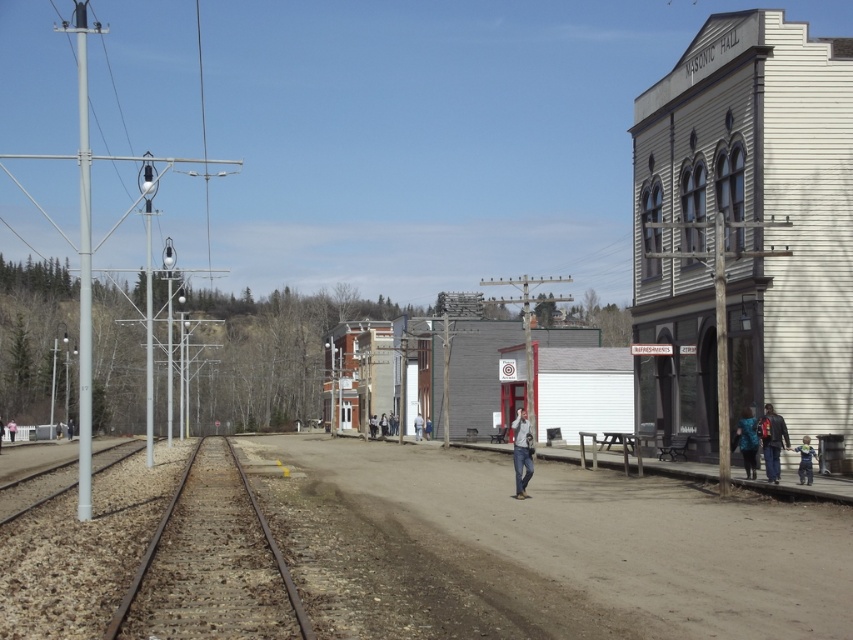
You are standing at the center of the dirt road in the small town scene. You want to place a new bench exactly at the point where the denim jeans at center are located. Is this location suitable for placing the bench?

The denim jeans at center are located at point (521,452), so placing a bench there would be suitable as it is a central and visible spot on the dirt road.

You are standing at the Masonic Hall and want to greet the person wearing the white cotton shirt at center. In which direction should you walk to reach them?

You should walk towards the center of the image where the white cotton shirt at center is located at point coordinates (372, 426).